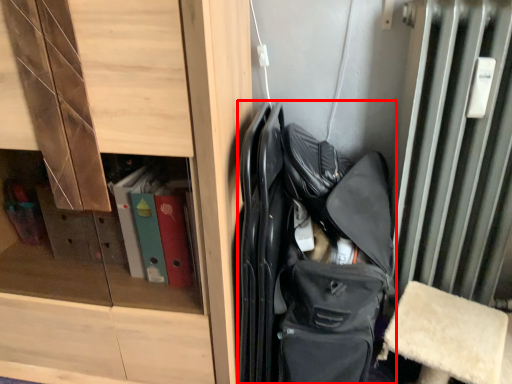
Question: From the image's perspective, where is bag (annotated by the red box) located in relation to cabinetry in the image?

Choices:
 (A) above
 (B) below

Answer: (B)